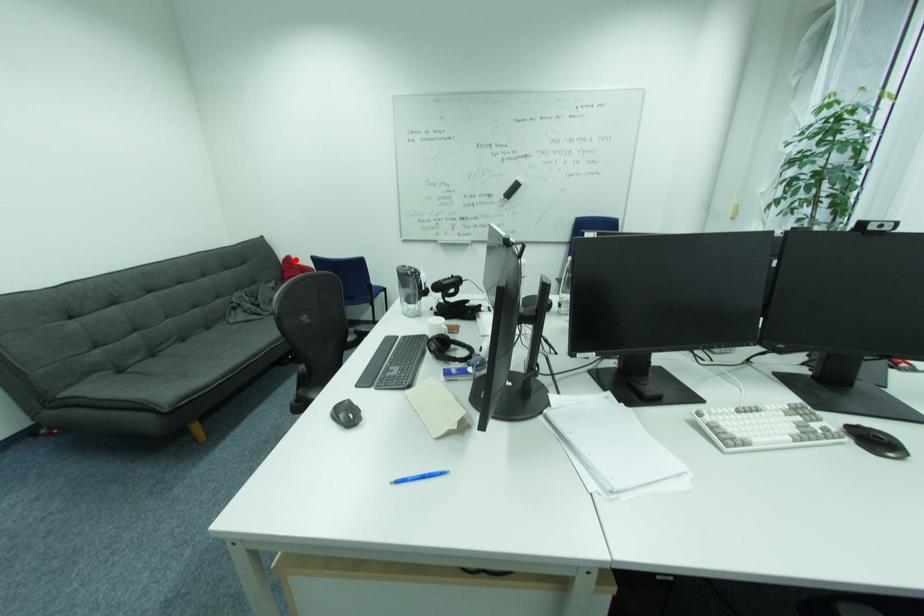
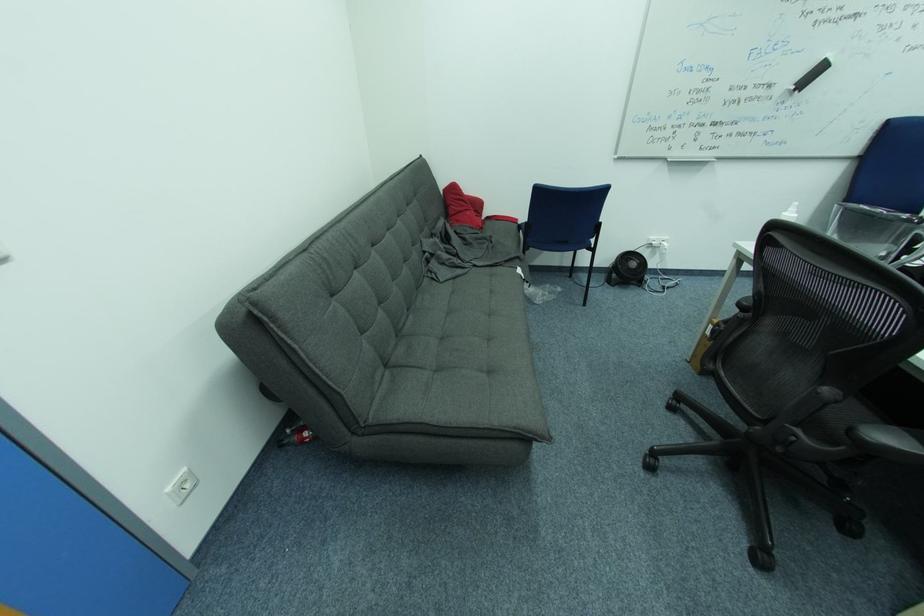
Locate, in the second image, the point that corresponds to the highlighted location in the first image.

(459, 188)